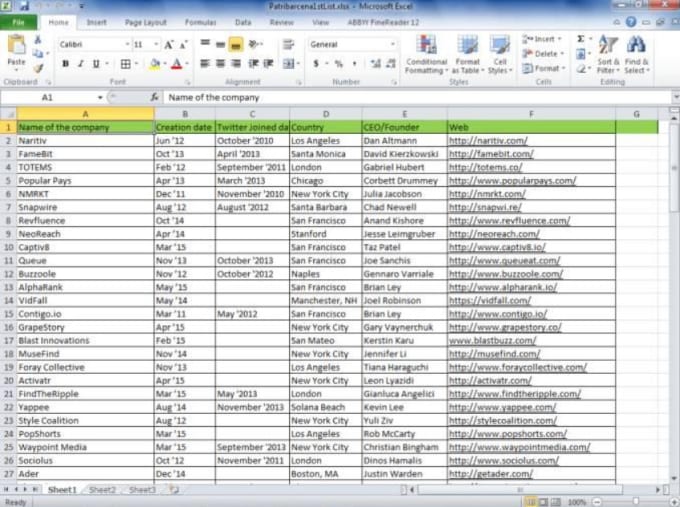
Image resolution: width=680 pixels, height=507 pixels. I want to click on columns, so click(7, 125), click(109, 130), click(181, 129), click(226, 126), click(302, 126), click(375, 125), click(455, 125), click(634, 128).